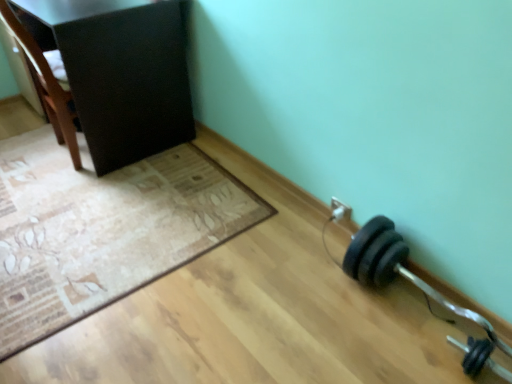
Where is `free space above beige textured mat at lower left (from a real-world perspective)`? free space above beige textured mat at lower left (from a real-world perspective) is located at coordinates (100, 196).